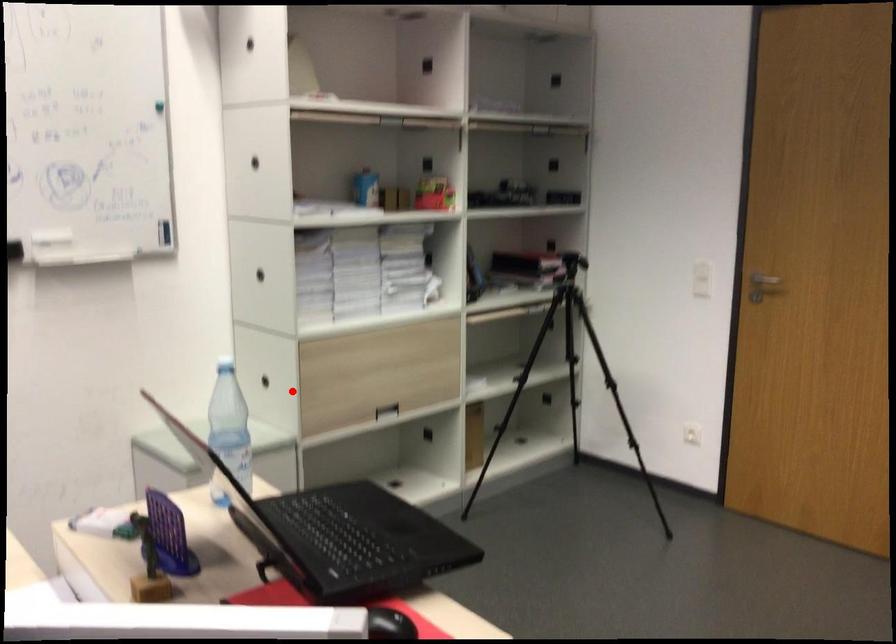
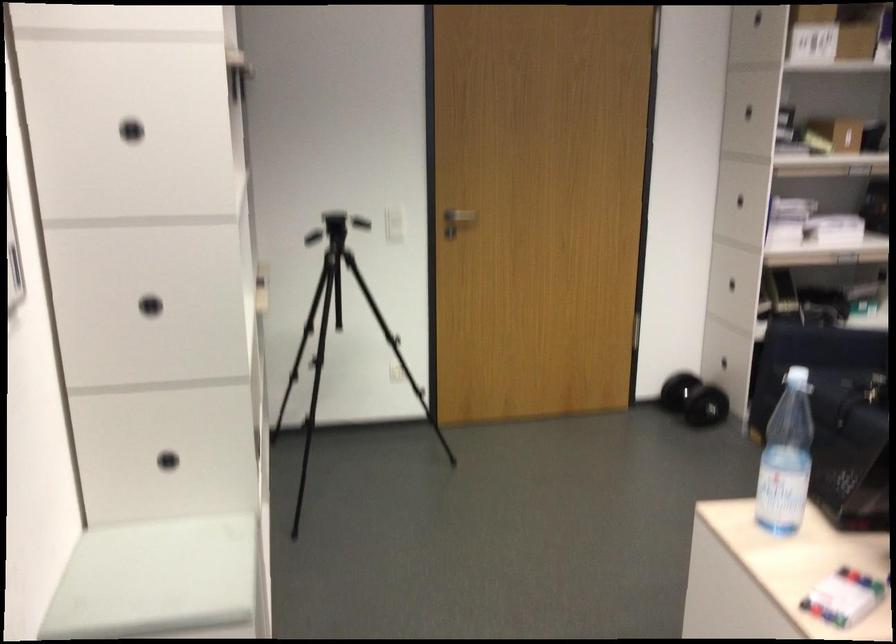
Where in the second image is the point corresponding to the highlighted location from the first image?

(167, 460)